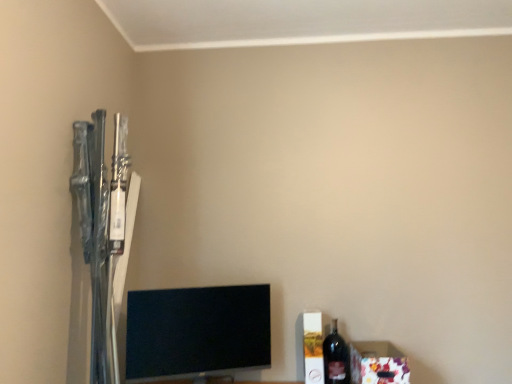
Question: Does floral paper box at lower right turn towards dark glass bottle at lower right?

Choices:
 (A) no
 (B) yes

Answer: (A)

Question: Can we say floral paper box at lower right lies outside dark glass bottle at lower right?

Choices:
 (A) yes
 (B) no

Answer: (A)

Question: Is the position of floral paper box at lower right less distant than that of dark glass bottle at lower right?

Choices:
 (A) no
 (B) yes

Answer: (B)

Question: Is floral paper box at lower right turned away from dark glass bottle at lower right?

Choices:
 (A) yes
 (B) no

Answer: (B)

Question: Is floral paper box at lower right at the right side of dark glass bottle at lower right?

Choices:
 (A) no
 (B) yes

Answer: (B)

Question: Is floral paper box at lower right next to dark glass bottle at lower right?

Choices:
 (A) no
 (B) yes

Answer: (A)

Question: Is dark glass bottle at lower right thinner than floral paper box at lower right?

Choices:
 (A) no
 (B) yes

Answer: (B)

Question: Is the surface of dark glass bottle at lower right in direct contact with floral paper box at lower right?

Choices:
 (A) no
 (B) yes

Answer: (A)

Question: Does dark glass bottle at lower right turn towards floral paper box at lower right?

Choices:
 (A) no
 (B) yes

Answer: (A)

Question: From a real-world perspective, is dark glass bottle at lower right located beneath floral paper box at lower right?

Choices:
 (A) yes
 (B) no

Answer: (B)

Question: Considering the relative sizes of dark glass bottle at lower right and floral paper box at lower right in the image provided, is dark glass bottle at lower right taller than floral paper box at lower right?

Choices:
 (A) yes
 (B) no

Answer: (A)

Question: Does dark glass bottle at lower right appear on the right side of floral paper box at lower right?

Choices:
 (A) yes
 (B) no

Answer: (B)

Question: Could you tell me if floral paper box at lower right is facing black glossy tv at lower center?

Choices:
 (A) yes
 (B) no

Answer: (B)